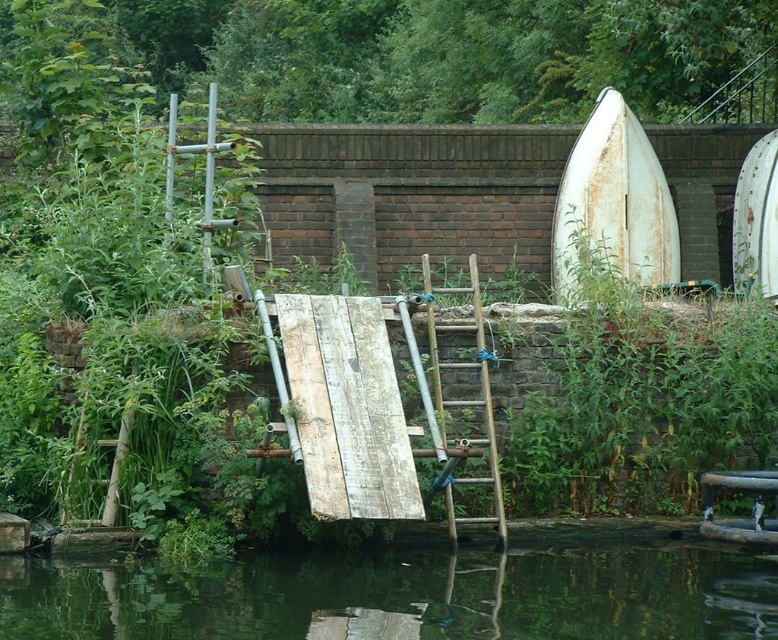
Question: Is rusty white boat at upper right wider than white matte surfboard at upper right?

Choices:
 (A) yes
 (B) no

Answer: (A)

Question: Which of these objects is positioned closest to the green smooth water at lower center?

Choices:
 (A) rusty white boat at upper right
 (B) wooden ladder at center

Answer: (B)

Question: Which object is positioned closest to the wooden ladder at center?

Choices:
 (A) green smooth water at lower center
 (B) white matte surfboard at upper right
 (C) rusty white boat at upper right

Answer: (A)

Question: Is rusty white boat at upper right to the left of wooden ladder at center from the viewer's perspective?

Choices:
 (A) yes
 (B) no

Answer: (B)

Question: Does green smooth water at lower center appear over wooden ladder at center?

Choices:
 (A) no
 (B) yes

Answer: (A)

Question: Which object is positioned farthest from the wooden ladder at center?

Choices:
 (A) rusty white boat at upper right
 (B) white matte surfboard at upper right
 (C) green smooth water at lower center

Answer: (B)